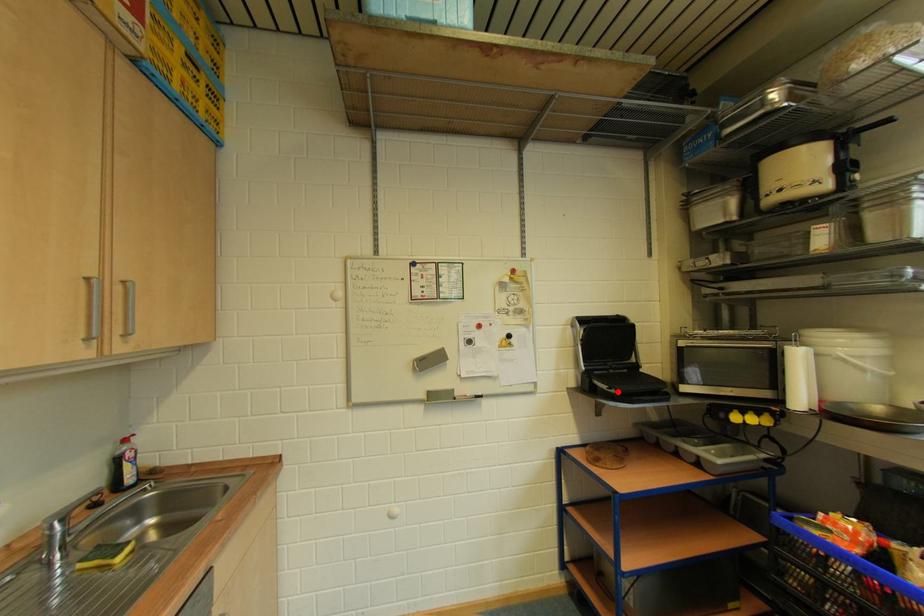
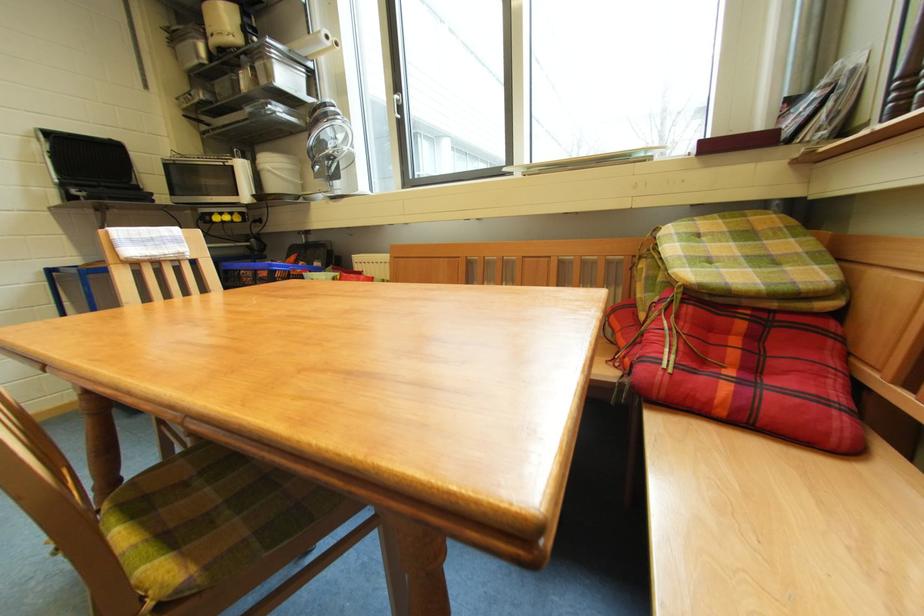
The point at the highlighted location is marked in the first image. Where is the corresponding point in the second image?

(88, 193)